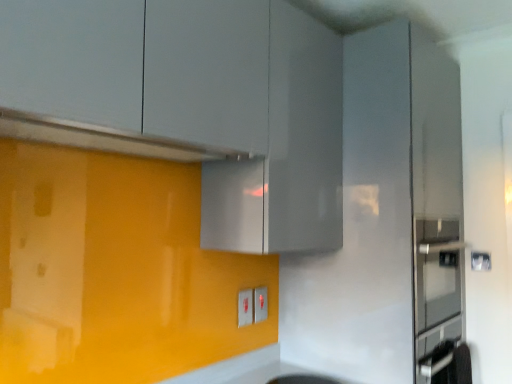
Question: In which direction should I rotate to look at matte white electric outlet at lower center, which appears as the 2th electric outlet when viewed from the left?

Choices:
 (A) right
 (B) left

Answer: (A)

Question: Is matte white electric outlet at lower center, which appears as the 2th electric outlet when viewed from the left, positioned before matte gray cabinet at upper center?

Choices:
 (A) yes
 (B) no

Answer: (B)

Question: Is matte white electric outlet at lower center, which is the 1th electric outlet from back to front, at the right side of matte gray cabinet at upper center?

Choices:
 (A) yes
 (B) no

Answer: (A)

Question: From the image's perspective, is matte white electric outlet at lower center, which appears as the 2th electric outlet when viewed from the left, over matte gray cabinet at upper center?

Choices:
 (A) yes
 (B) no

Answer: (B)

Question: Is matte white electric outlet at lower center, which appears as the 2th electric outlet when viewed from the left, not within matte gray cabinet at upper center?

Choices:
 (A) yes
 (B) no

Answer: (A)

Question: Is matte white electric outlet at lower center, which is the first electric outlet from right to left, taller than matte gray cabinet at upper center?

Choices:
 (A) yes
 (B) no

Answer: (B)

Question: From a real-world perspective, does matte white electric outlet at lower center, which is the 1th electric outlet from back to front, stand above matte gray cabinet at upper center?

Choices:
 (A) no
 (B) yes

Answer: (A)

Question: Is white plastic electric outlet at center, the 2th electric outlet positioned from the right, beside satin silver exhaust hood at upper center?

Choices:
 (A) no
 (B) yes

Answer: (A)

Question: From the image's perspective, is white plastic electric outlet at center, the 2th electric outlet positioned from the right, under satin silver exhaust hood at upper center?

Choices:
 (A) no
 (B) yes

Answer: (B)

Question: Is the position of white plastic electric outlet at center, the 2th electric outlet positioned from the right, less distant than that of satin silver exhaust hood at upper center?

Choices:
 (A) no
 (B) yes

Answer: (A)

Question: Are white plastic electric outlet at center, the 2th electric outlet positioned from the right, and satin silver exhaust hood at upper center located far from each other?

Choices:
 (A) yes
 (B) no

Answer: (B)

Question: Considering the relative sizes of white plastic electric outlet at center, the 1th electric outlet in the front-to-back sequence, and satin silver exhaust hood at upper center in the image provided, is white plastic electric outlet at center, the 1th electric outlet in the front-to-back sequence, thinner than satin silver exhaust hood at upper center?

Choices:
 (A) yes
 (B) no

Answer: (A)

Question: Is white plastic electric outlet at center, the 2th electric outlet positioned from the right, oriented towards satin silver exhaust hood at upper center?

Choices:
 (A) no
 (B) yes

Answer: (A)

Question: Would you say matte white electric outlet at lower center, arranged as the second electric outlet when viewed from the front, is outside satin silver exhaust hood at upper center?

Choices:
 (A) yes
 (B) no

Answer: (A)